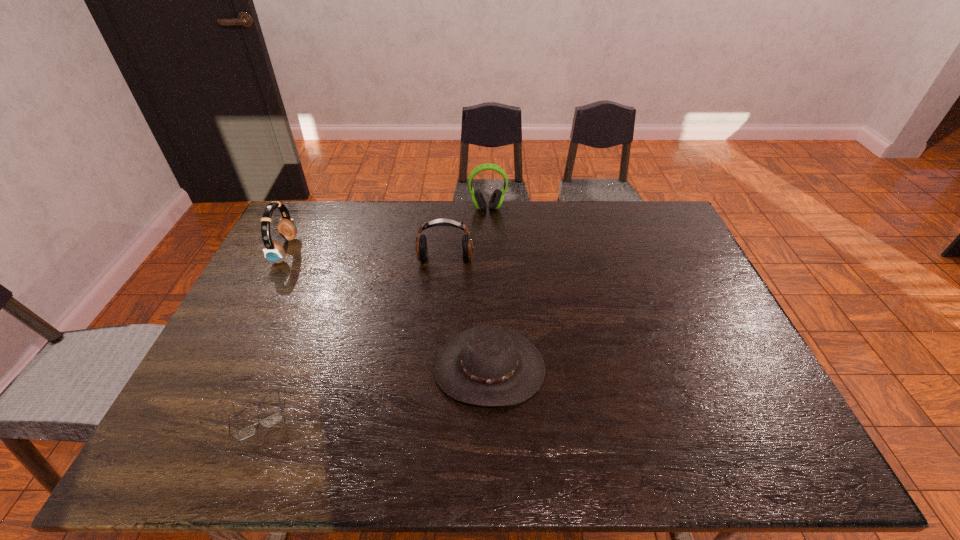
Locate an element on the screen. This screenshot has height=540, width=960. headset positioned at the left edge is located at coordinates (274, 251).

Find the location of a particular element. spectacles present at the left edge is located at coordinates coord(275,418).

The image size is (960, 540). Identify the location of object that is at the far left corner. coord(274,251).

I want to click on object present at the near left corner, so click(275, 418).

This screenshot has height=540, width=960. I want to click on free space at the far edge of the desktop, so click(x=356, y=231).

Where is `vacant space at the near edge of the desktop`? This screenshot has height=540, width=960. vacant space at the near edge of the desktop is located at coordinates (339, 464).

This screenshot has height=540, width=960. I want to click on vacant space at the left edge of the desktop, so click(x=237, y=428).

In the image, there is a desktop. Where is `vacant space at the right edge`? This screenshot has width=960, height=540. vacant space at the right edge is located at coordinates (669, 312).

You are a GUI agent. You are given a task and a screenshot of the screen. Output one action in this format:
    pyautogui.click(x=<x>, y=<y>)
    Task: Click on the blank space at the far right corner of the desktop
    
    Given the screenshot: What is the action you would take?
    pyautogui.click(x=633, y=231)

In the image, there is a desktop. Identify the location of blank space at the near right corner. The height and width of the screenshot is (540, 960). (774, 458).